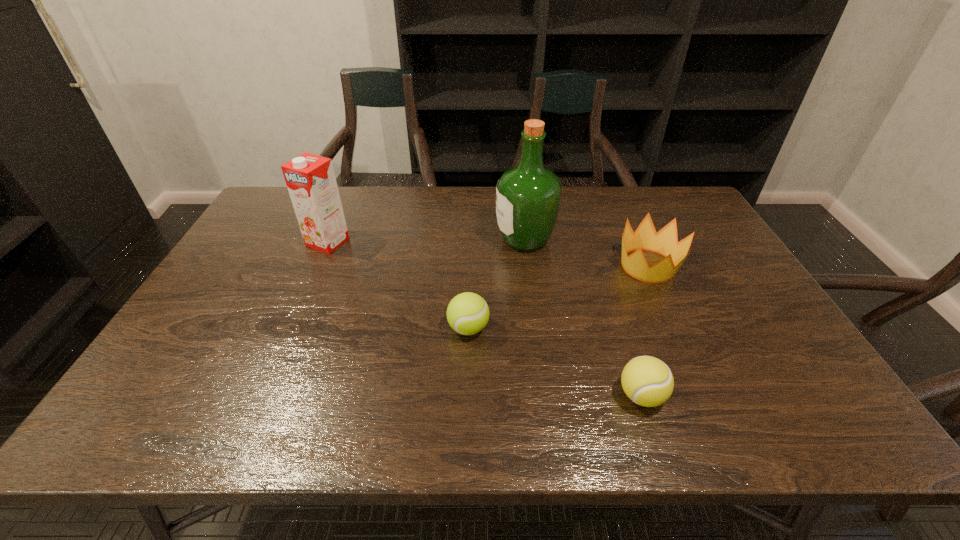
Image resolution: width=960 pixels, height=540 pixels. Identify the location of vacant space at the right edge of the desktop. (706, 276).

Find the location of a particular element. The height and width of the screenshot is (540, 960). vacant position at the far right corner of the desktop is located at coordinates (677, 207).

The height and width of the screenshot is (540, 960). In the image, there is a desktop. In order to click on free region at the near right corner in this screenshot , I will do `click(830, 413)`.

This screenshot has width=960, height=540. What are the coordinates of `empty location between the crown and the carton` in the screenshot? It's located at (488, 254).

Identify the location of vacant area between the crown and the nearest object. Image resolution: width=960 pixels, height=540 pixels. (645, 331).

The width and height of the screenshot is (960, 540). I want to click on vacant area between the carton and the farther tennis ball, so click(398, 285).

Locate an element on the screen. free space between the farther tennis ball and the fourth shortest object is located at coordinates [x=398, y=285].

Locate an element on the screen. This screenshot has height=540, width=960. vacant point located between the second tallest object and the farther tennis ball is located at coordinates (398, 285).

What are the coordinates of `free area in between the carton and the third object from left to right` in the screenshot? It's located at (426, 241).

Find the location of `free spot between the left tennis ball and the fourth shortest object`. free spot between the left tennis ball and the fourth shortest object is located at coordinates (398, 285).